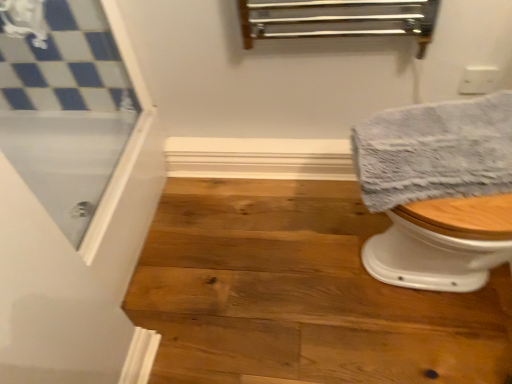
The width and height of the screenshot is (512, 384). I want to click on free space above natural wood stair at lower right (from a real-world perspective), so coord(295,271).